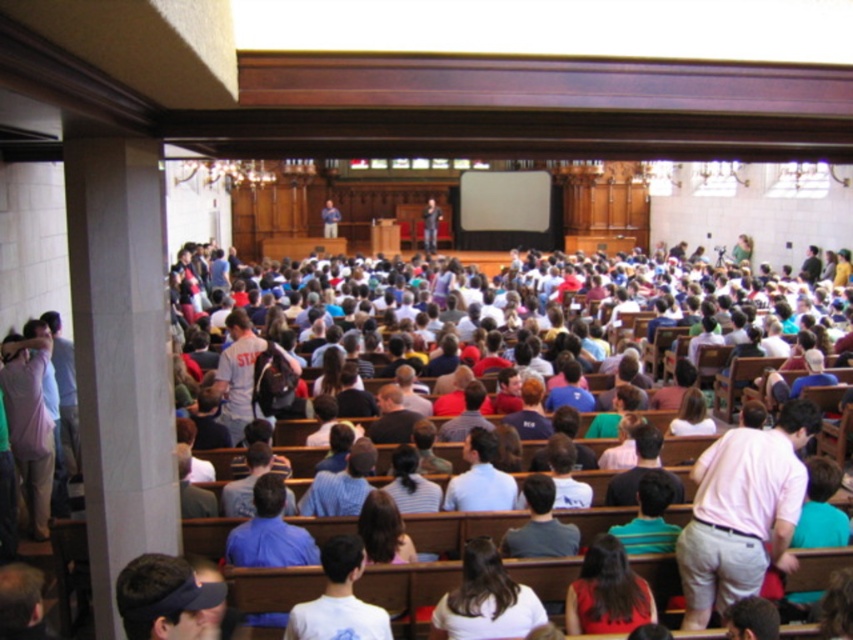
Between dark brown hair at center and dark brown hair at lower center, which one is positioned lower?

dark brown hair at lower center is below.

Which of these two, dark brown hair at center or dark brown hair at lower center, stands taller?

dark brown hair at lower center is taller.

The width and height of the screenshot is (853, 640). What do you see at coordinates (485, 600) in the screenshot?
I see `dark brown hair at center` at bounding box center [485, 600].

Where is `dark brown hair at center`? dark brown hair at center is located at coordinates (485, 600).

Who is positioned more to the left, dark brown hair at center or white cotton shirt at center?

white cotton shirt at center

Between dark brown hair at center and white cotton shirt at center, which one appears on the right side from the viewer's perspective?

Positioned to the right is dark brown hair at center.

Locate an element on the screen. dark brown hair at center is located at coordinates (485, 600).

The width and height of the screenshot is (853, 640). What are the coordinates of `dark brown hair at center` in the screenshot? It's located at (485, 600).

How much distance is there between white cotton shirt at center and light blue shirt at center?

The distance of white cotton shirt at center from light blue shirt at center is 9.03 feet.

Does white cotton shirt at center appear on the left side of light blue shirt at center?

Yes, white cotton shirt at center is to the left of light blue shirt at center.

Is point (335, 612) more distant than point (476, 436)?

No.

You are a GUI agent. You are given a task and a screenshot of the screen. Output one action in this format:
    pyautogui.click(x=<x>, y=<y>)
    Task: Click on the white cotton shirt at center
    The height and width of the screenshot is (640, 853).
    Given the screenshot: What is the action you would take?
    pyautogui.click(x=338, y=600)